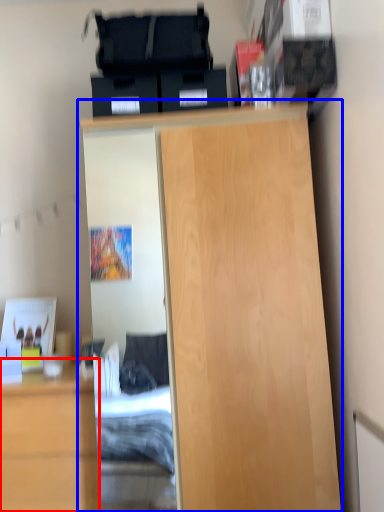
Question: Which of the following is the farthest to the observer, cabinetry (highlighted by a red box) or cupboard (highlighted by a blue box)?

Choices:
 (A) cabinetry
 (B) cupboard

Answer: (A)